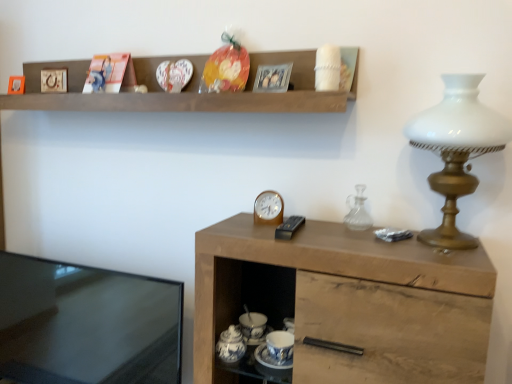
Question: Considering the relative sizes of wooden picture frame at upper left, positioned as the second picture frame in left-to-right order, and transparent glass carafe at right in the image provided, is wooden picture frame at upper left, positioned as the second picture frame in left-to-right order, shorter than transparent glass carafe at right?

Choices:
 (A) no
 (B) yes

Answer: (B)

Question: Is wooden picture frame at upper left, which ranks as the 2th picture frame in back-to-front order, positioned behind transparent glass carafe at right?

Choices:
 (A) no
 (B) yes

Answer: (B)

Question: Considering the relative positions of wooden picture frame at upper left, the second picture frame when ordered from front to back, and transparent glass carafe at right in the image provided, is wooden picture frame at upper left, the second picture frame when ordered from front to back, to the right of transparent glass carafe at right from the viewer's perspective?

Choices:
 (A) yes
 (B) no

Answer: (B)

Question: Is wooden picture frame at upper left, which ranks as the 2th picture frame in back-to-front order, smaller than transparent glass carafe at right?

Choices:
 (A) no
 (B) yes

Answer: (B)

Question: Are wooden picture frame at upper left, which ranks as the 2th picture frame in back-to-front order, and transparent glass carafe at right far apart?

Choices:
 (A) yes
 (B) no

Answer: (A)

Question: In the image, is black glossy tv at left positioned in front of or behind wooden picture frame at upper left, which ranks as the 2th picture frame in back-to-front order?

Choices:
 (A) behind
 (B) front

Answer: (B)

Question: In terms of size, does black glossy tv at left appear bigger or smaller than wooden picture frame at upper left, positioned as the second picture frame in left-to-right order?

Choices:
 (A) small
 (B) big

Answer: (B)

Question: From a real-world perspective, is black glossy tv at left physically located above or below wooden picture frame at upper left, which is counted as the second picture frame, starting from the right?

Choices:
 (A) above
 (B) below

Answer: (B)

Question: Looking at their shapes, would you say black glossy tv at left is wider or thinner than wooden picture frame at upper left, positioned as the second picture frame in left-to-right order?

Choices:
 (A) wide
 (B) thin

Answer: (A)

Question: Considering the positions of point (12, 82) and point (54, 69), is point (12, 82) closer or farther from the camera than point (54, 69)?

Choices:
 (A) closer
 (B) farther

Answer: (B)

Question: From the image's perspective, relative to wooden picture frame at upper left, which ranks as the 2th picture frame in back-to-front order, is matte wooden picture frame at upper left, marked as the first picture frame in a left-to-right arrangement, above or below?

Choices:
 (A) above
 (B) below

Answer: (B)

Question: In terms of size, does matte wooden picture frame at upper left, acting as the first picture frame starting from the back, appear bigger or smaller than wooden picture frame at upper left, positioned as the second picture frame in left-to-right order?

Choices:
 (A) small
 (B) big

Answer: (A)

Question: In terms of height, does matte wooden picture frame at upper left, marked as the third picture frame in a front-to-back arrangement, look taller or shorter compared to wooden picture frame at upper left, positioned as the second picture frame in left-to-right order?

Choices:
 (A) tall
 (B) short

Answer: (B)

Question: Looking at their shapes, would you say wooden cabinet at right is wider or thinner than wooden picture frame at upper left, which is counted as the second picture frame, starting from the right?

Choices:
 (A) thin
 (B) wide

Answer: (B)

Question: From the image's perspective, is wooden cabinet at right located above or below wooden picture frame at upper left, the second picture frame when ordered from front to back?

Choices:
 (A) above
 (B) below

Answer: (B)